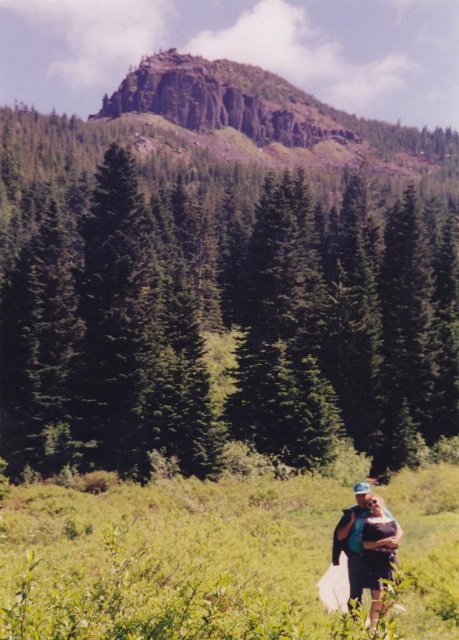
Question: Does green matte tree at center lie behind green grassy field at lower center?

Choices:
 (A) no
 (B) yes

Answer: (B)

Question: Is green grassy field at lower center closer to the viewer compared to matte blue shirt at lower right?

Choices:
 (A) yes
 (B) no

Answer: (A)

Question: Which point is farther to the camera?

Choices:
 (A) green grassy field at lower center
 (B) green matte tree at center

Answer: (B)

Question: Which point is farther to the camera?

Choices:
 (A) (37, 412)
 (B) (0, 602)

Answer: (A)

Question: Is green grassy field at lower center bigger than matte blue shirt at lower right?

Choices:
 (A) yes
 (B) no

Answer: (A)

Question: Which point is closer to the camera?

Choices:
 (A) matte blue shirt at lower right
 (B) green grassy field at lower center

Answer: (B)